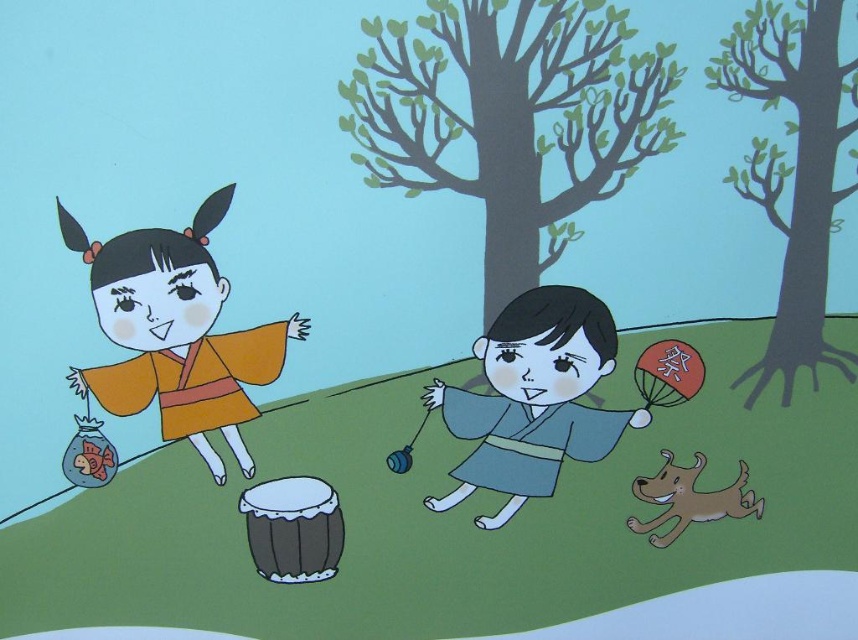
Question: Where is orange matte kimono at left located in relation to brown matte dog at lower right in the image?

Choices:
 (A) right
 (B) left

Answer: (B)

Question: Based on their relative distances, which object is nearer to the matte blue kimono at center?

Choices:
 (A) orange matte kimono at left
 (B) brown matte dog at lower right

Answer: (B)

Question: Does orange matte kimono at left come in front of matte blue kimono at center?

Choices:
 (A) yes
 (B) no

Answer: (A)

Question: Which point appears farthest from the camera in this image?

Choices:
 (A) (73, 372)
 (B) (720, 509)
 (C) (575, 339)

Answer: (B)

Question: Which of the following is the closest to the observer?

Choices:
 (A) matte blue kimono at center
 (B) orange matte kimono at left
 (C) brown matte dog at lower right

Answer: (B)

Question: Does matte blue kimono at center have a smaller size compared to brown matte dog at lower right?

Choices:
 (A) yes
 (B) no

Answer: (B)